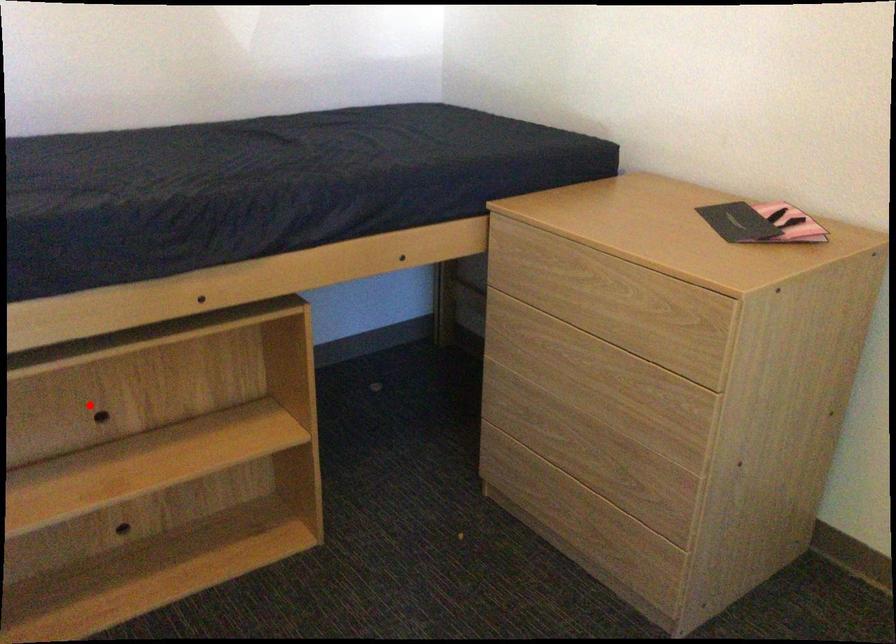
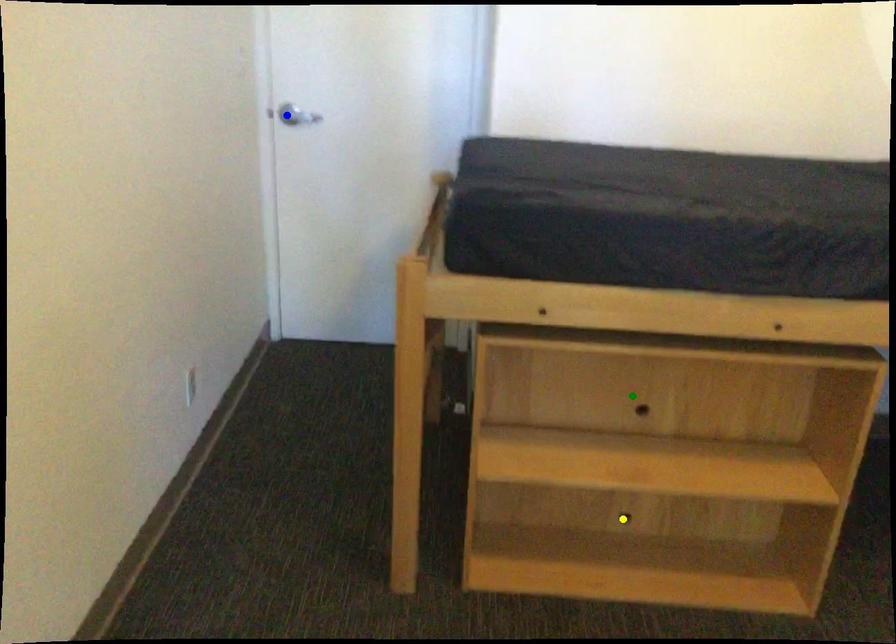
Question: I am providing you with two images of the same scene from different viewpoints. A red point is marked on the first image. You are given multiple points on the second image. Which mark in image 2 goes with the point in image 1?

Choices:
 (A) yellow point
 (B) green point
 (C) blue point

Answer: (B)